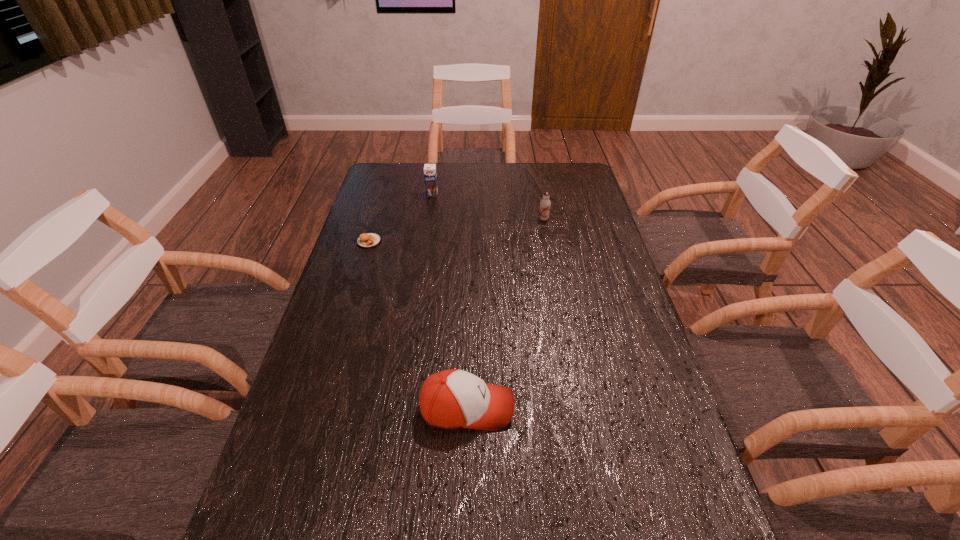
The height and width of the screenshot is (540, 960). I want to click on vacant space located 0.390m on the front of the nearer chocolate milk, so click(559, 299).

The height and width of the screenshot is (540, 960). Identify the location of free region located on the front of the leftmost object. (361, 267).

The image size is (960, 540). In order to click on object that is at the far edge in this screenshot , I will do `click(430, 176)`.

Identify the location of object that is at the left edge. Image resolution: width=960 pixels, height=540 pixels. (369, 240).

Where is `blank area at the far edge`? blank area at the far edge is located at coordinates (480, 191).

In the image, there is a desktop. Where is `vacant region at the left edge`? vacant region at the left edge is located at coordinates pos(274,488).

Where is `vacant space at the right edge`? This screenshot has width=960, height=540. vacant space at the right edge is located at coordinates (586, 331).

This screenshot has height=540, width=960. In order to click on free space that is in between the nearest object and the left chocolate milk in this screenshot , I will do `click(449, 301)`.

Where is `free space between the taller chocolate milk and the shortest object`? free space between the taller chocolate milk and the shortest object is located at coordinates (400, 218).

Find the location of `vacant region between the leftmost object and the third object from left to right`. vacant region between the leftmost object and the third object from left to right is located at coordinates (418, 325).